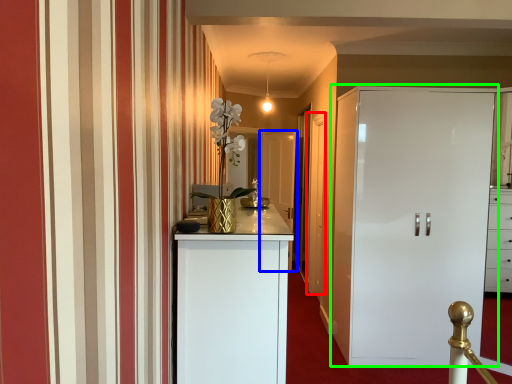
Question: Based on their relative distances, which object is farther from door (highlighted by a red box)? Choose from door (highlighted by a blue box) and cupboard (highlighted by a green box).

Choices:
 (A) door
 (B) cupboard

Answer: (A)